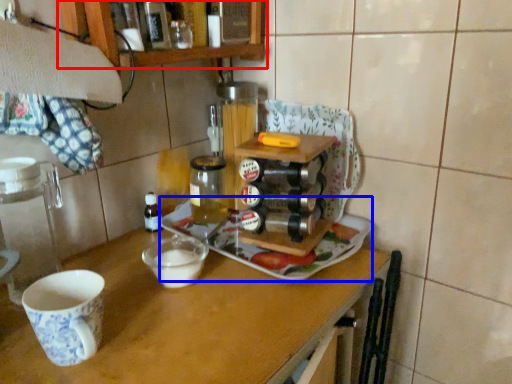
Question: Which point is further to the camera, cabinetry (highlighted by a red box) or tray (highlighted by a blue box)?

Choices:
 (A) cabinetry
 (B) tray

Answer: (B)